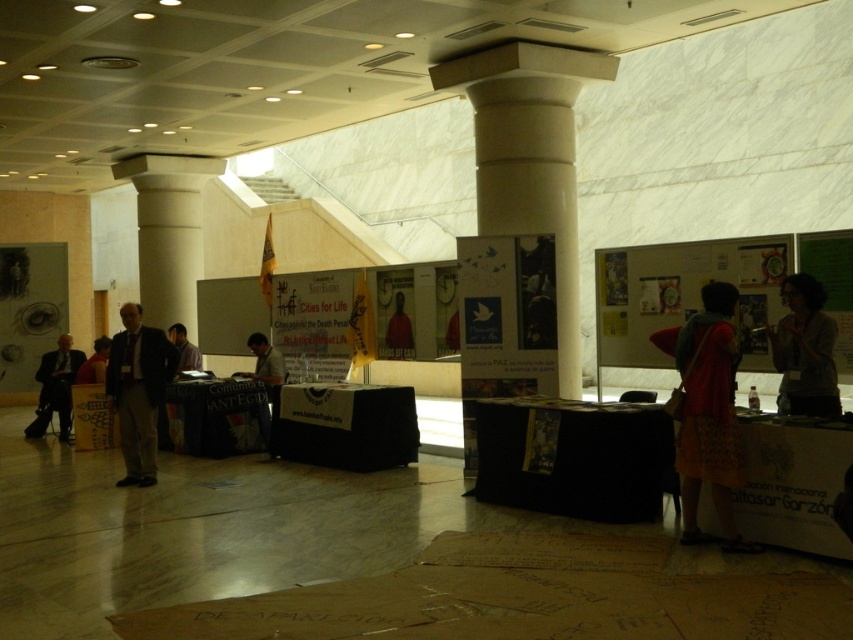
Question: Which of the following is the farthest from the observer?

Choices:
 (A) (67, 436)
 (B) (96, 353)
 (C) (828, 417)

Answer: (A)

Question: Can you confirm if white marble pillar at center is smaller than matte red shirt at center?

Choices:
 (A) yes
 (B) no

Answer: (B)

Question: Estimate the real-world distances between objects in this image. Which object is closer to the matte black poster at left?

Choices:
 (A) white marble pillar at center
 (B) matte brown shirt at center
 (C) matte paper poster at center
 (D) dark gray suit at left

Answer: (C)

Question: Is matte black poster at left further to camera compared to light brown paper bag at center?

Choices:
 (A) no
 (B) yes

Answer: (B)

Question: Is white marble pillar at center to the right of matte brown shirt at center from the viewer's perspective?

Choices:
 (A) no
 (B) yes

Answer: (B)

Question: Which object is farther from the camera taking this photo?

Choices:
 (A) matte paper poster at center
 (B) orange fabric dress at lower right
 (C) matte black poster at left
 (D) light brown paper bag at center

Answer: (C)